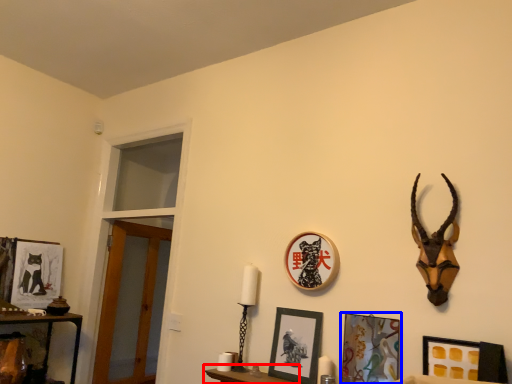
Question: Which of the following is the farthest to the observer, furniture (highlighted by a red box) or picture frame (highlighted by a blue box)?

Choices:
 (A) furniture
 (B) picture frame

Answer: (A)